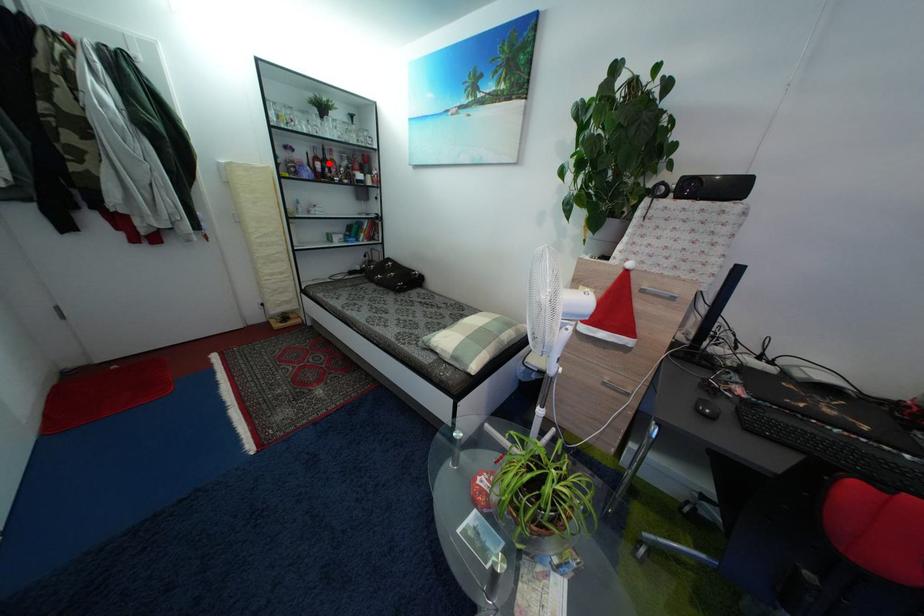
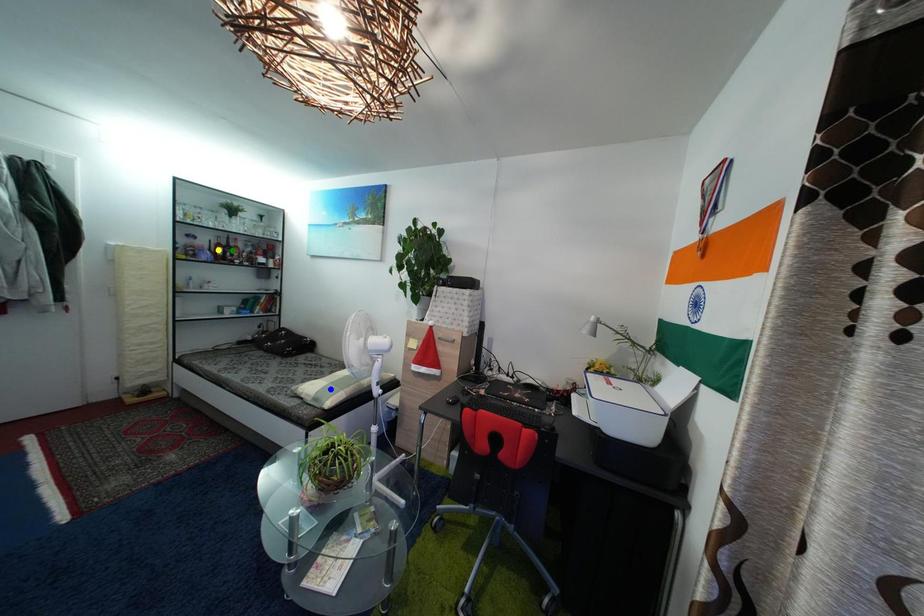
Question: I am providing you with two images of the same scene from different viewpoints. A red point is marked on the first image. You are given multiple points on the second image. Which point in image 2 is actually the same real-world point as the red point in image 1?

Choices:
 (A) green point
 (B) yellow point
 (C) blue point

Answer: (A)